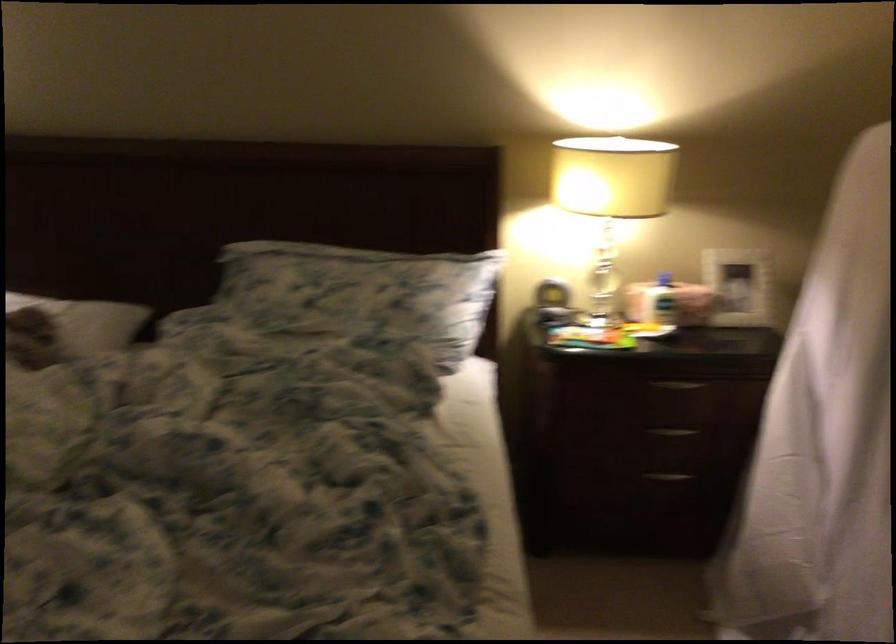
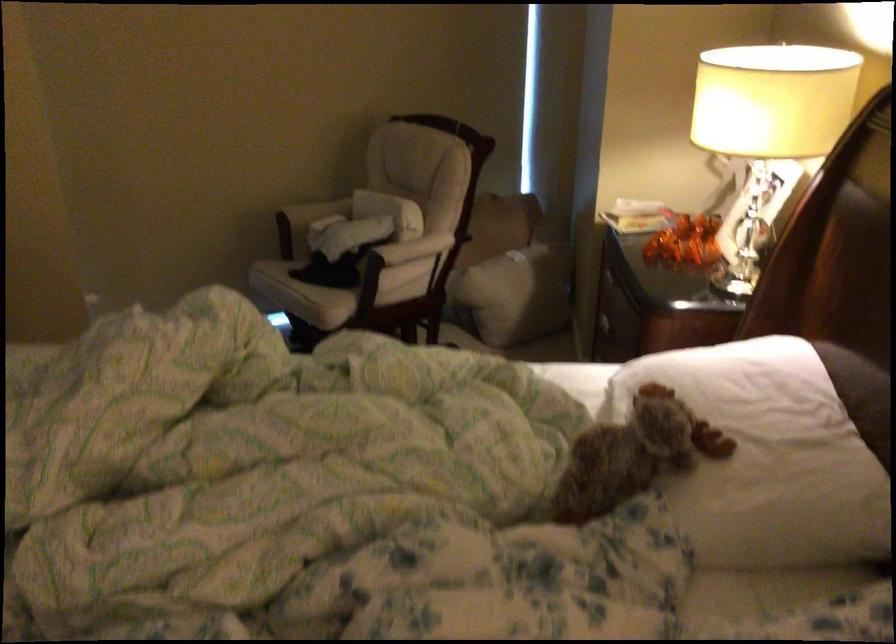
The point at [73,314] is marked in the first image. Where is the corresponding point in the second image?

(767, 458)